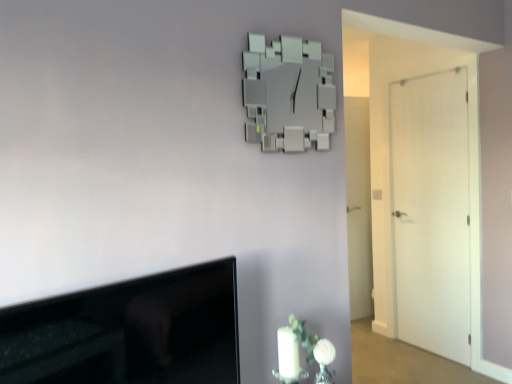
Question: Is white matte vase at lower right wider than white matte door at right, which ranks as the second door in front-to-back order?

Choices:
 (A) no
 (B) yes

Answer: (B)

Question: From a real-world perspective, is white matte vase at lower right under white matte door at right, the 1th door from the back?

Choices:
 (A) yes
 (B) no

Answer: (A)

Question: Is white matte vase at lower right positioned before white matte door at right, which ranks as the second door in front-to-back order?

Choices:
 (A) no
 (B) yes

Answer: (B)

Question: Does white matte vase at lower right appear on the left side of white matte door at right, the 1th door from the back?

Choices:
 (A) no
 (B) yes

Answer: (B)

Question: Considering the relative positions of white matte vase at lower right and white matte door at right, which ranks as the second door in front-to-back order, in the image provided, is white matte vase at lower right to the right of white matte door at right, which ranks as the second door in front-to-back order, from the viewer's perspective?

Choices:
 (A) no
 (B) yes

Answer: (A)

Question: Is white matte vase at lower right facing towards white matte door at right, the 1th door from the back?

Choices:
 (A) no
 (B) yes

Answer: (A)

Question: From the image's perspective, is white matte door at right, the second door when ordered from left to right, over black glossy tv at lower left?

Choices:
 (A) no
 (B) yes

Answer: (B)

Question: Could you tell me if white matte door at right, the second door when ordered from left to right, is turned towards black glossy tv at lower left?

Choices:
 (A) no
 (B) yes

Answer: (A)

Question: Would you say black glossy tv at lower left is part of white matte door at right, the second door when ordered from left to right,'s contents?

Choices:
 (A) no
 (B) yes

Answer: (A)

Question: From a real-world perspective, is white matte door at right, which is the first door in right-to-left order, located beneath black glossy tv at lower left?

Choices:
 (A) no
 (B) yes

Answer: (A)

Question: Can you confirm if white matte door at right, the second door when ordered from left to right, is bigger than black glossy tv at lower left?

Choices:
 (A) no
 (B) yes

Answer: (B)

Question: Considering the relative sizes of white matte door at right, which appears as the first door when viewed from the front, and black glossy tv at lower left in the image provided, is white matte door at right, which appears as the first door when viewed from the front, shorter than black glossy tv at lower left?

Choices:
 (A) no
 (B) yes

Answer: (A)

Question: Considering the relative sizes of white matte vase at lower right and black glossy tv at lower left in the image provided, is white matte vase at lower right thinner than black glossy tv at lower left?

Choices:
 (A) no
 (B) yes

Answer: (B)